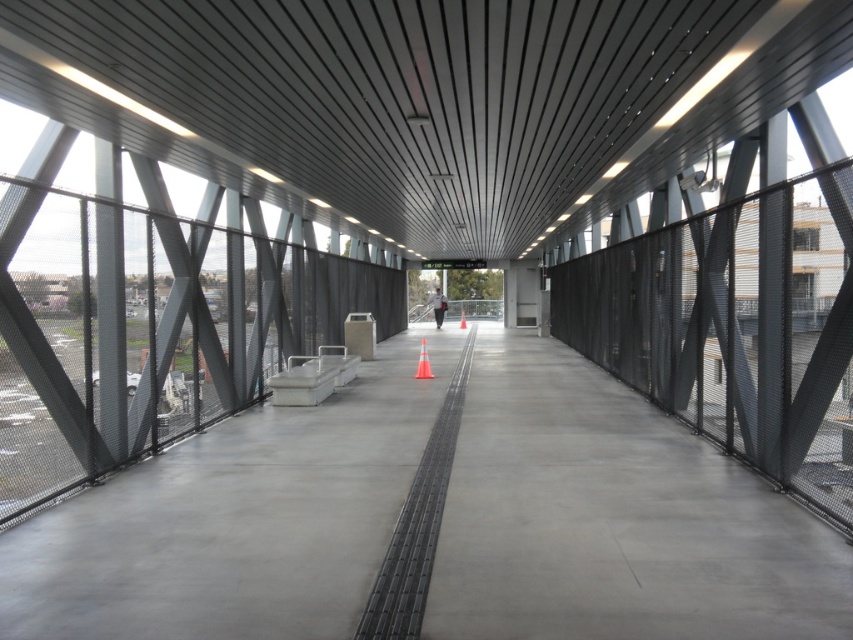
You are a pedestrian standing on the walkway and looking towards the metallic gray overpass at center. Do you see the orange reflective cone at center behind the overpass?

The metallic gray overpass at center is in front of the orange reflective cone at center, so yes, the orange reflective cone at center is behind the overpass and you can see it if you look past the overpass.

You are standing at the point with coordinates (424, 99) on the walkway. What structure would you be directly under?

At point (424, 99) lies metallic gray overpass at center, so you would be directly under the metallic gray overpass at center.

You are standing on the walkway and see two points marked on the ground. One is at point (x=106, y=49) and the other is at point (x=418, y=371). If you are facing the direction of the walkway, which point is closer to you?

Point (x=106, y=49) is in front of point (x=418, y=371), so if you are facing the direction of the walkway, point (x=106, y=49) is closer to you.